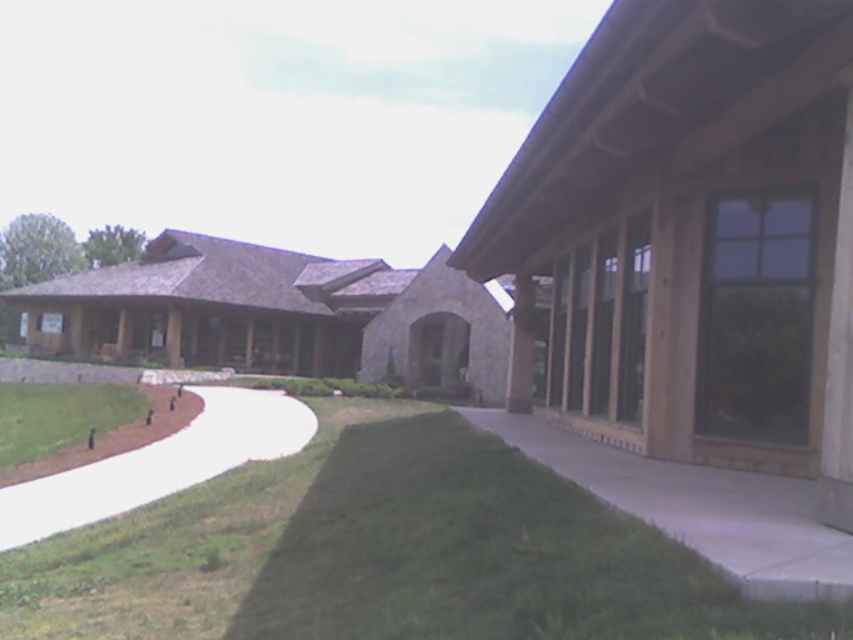
Question: Is concrete at center positioned behind green grass at lower left?

Choices:
 (A) no
 (B) yes

Answer: (A)

Question: Which is nearer to the concrete at center?

Choices:
 (A) white concrete path at lower left
 (B) green grass at lower center

Answer: (B)

Question: Is white concrete path at lower left below green grass at lower left?

Choices:
 (A) no
 (B) yes

Answer: (B)

Question: Considering the real-world distances, which object is closest to the concrete at center?

Choices:
 (A) green grass at lower left
 (B) green grass at lower center
 (C) white concrete path at lower left

Answer: (B)

Question: Is concrete at center wider than white concrete path at lower left?

Choices:
 (A) no
 (B) yes

Answer: (A)

Question: Which object appears closest to the camera in this image?

Choices:
 (A) concrete at center
 (B) green grass at lower left
 (C) green grass at lower center
 (D) white concrete path at lower left

Answer: (C)